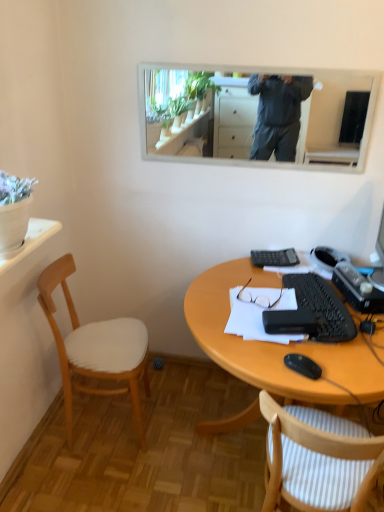
Question: In the image, is wooden desk at lower center positioned in front of or behind white paper at center?

Choices:
 (A) front
 (B) behind

Answer: (A)

Question: Considering the positions of point (380, 399) and point (246, 288), is point (380, 399) closer or farther from the camera than point (246, 288)?

Choices:
 (A) closer
 (B) farther

Answer: (A)

Question: Which object is the closest to the wooden chair with white cushion at left, the 2th chair positioned from the right?

Choices:
 (A) white paper at center
 (B) black plastic keyboard at center right
 (C) black plastic mouse at lower right
 (D) white striped fabric chair at lower right, marked as the second chair in a left-to-right arrangement
 (E) wooden desk at lower center

Answer: (E)

Question: Considering the real-world distances, which object is farthest from the white framed mirror at upper center?

Choices:
 (A) white striped fabric chair at lower right, marked as the second chair in a left-to-right arrangement
 (B) black plastic keyboard at center right
 (C) white paper at center
 (D) wooden chair with white cushion at left, which is counted as the 1th chair, starting from the left
 (E) black plastic mouse at lower right

Answer: (A)